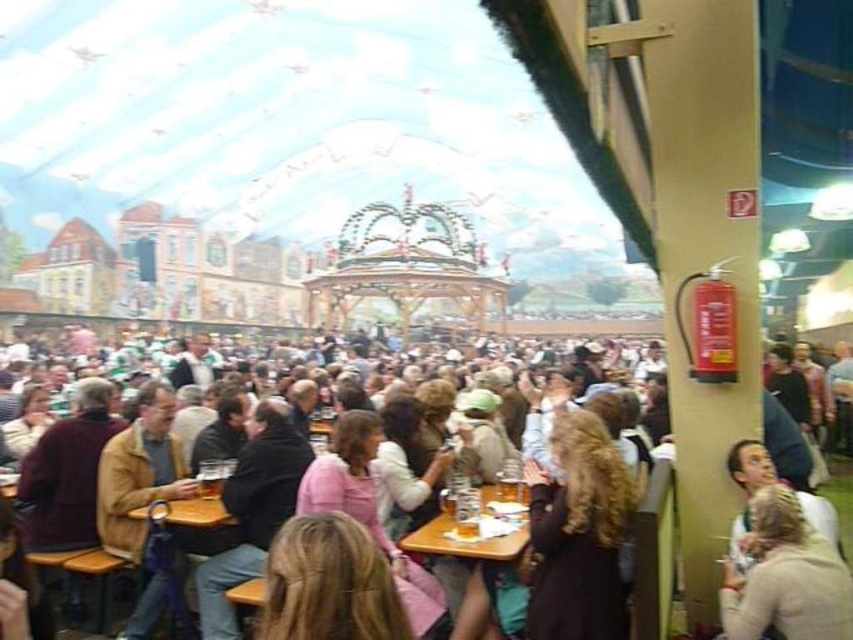
You are at a beer festival and want to sit down at the wooden table at center. However, there is a matte brown jacket at center. Is there enough space for you to sit without moving the jacket?

The matte brown jacket at center is above the wooden table at center, which means it is placed on top of the table. Since the jacket is on the table, there should be enough space to sit at the wooden table at center as long as there are available chairs. However, you might need to adjust the jacket slightly to make room for your belongings.

You are a guest at this event and want to place your matte brown jacket at center on the wooden table at center. Can you comfortably reach the table from where you are standing with the jacket?

The distance between the matte brown jacket at center and the wooden table at center is 12.85 meters. Since this distance is quite large, you would not be able to comfortably reach the table from where you are standing with the jacket.

You are at a festive event and want to sit down at the wooden table at center. There is a matte brown jacket at center in your way. Can you walk around it to reach the table?

The matte brown jacket at center is to the left of the wooden table at center, so you can walk around it on the right side to reach the table.